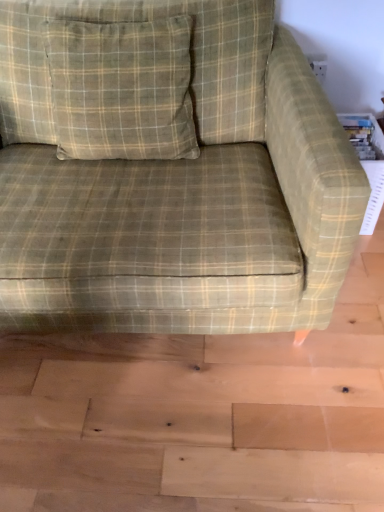
Question: From the image's perspective, is green plaid pillow at upper left positioned above or below green plaid fabric couch at center?

Choices:
 (A) below
 (B) above

Answer: (B)

Question: Is point (89, 48) positioned closer to the camera than point (231, 106)?

Choices:
 (A) farther
 (B) closer

Answer: (B)

Question: Is green plaid pillow at upper left in front of or behind green plaid fabric couch at center in the image?

Choices:
 (A) behind
 (B) front

Answer: (A)

Question: Looking at the image, does green plaid fabric couch at center seem bigger or smaller compared to green plaid pillow at upper left?

Choices:
 (A) small
 (B) big

Answer: (B)

Question: Based on their positions, is green plaid fabric couch at center located to the left or right of green plaid pillow at upper left?

Choices:
 (A) left
 (B) right

Answer: (B)

Question: Is green plaid fabric couch at center taller or shorter than green plaid pillow at upper left?

Choices:
 (A) short
 (B) tall

Answer: (B)

Question: From the image's perspective, is green plaid fabric couch at center positioned above or below green plaid pillow at upper left?

Choices:
 (A) below
 (B) above

Answer: (A)